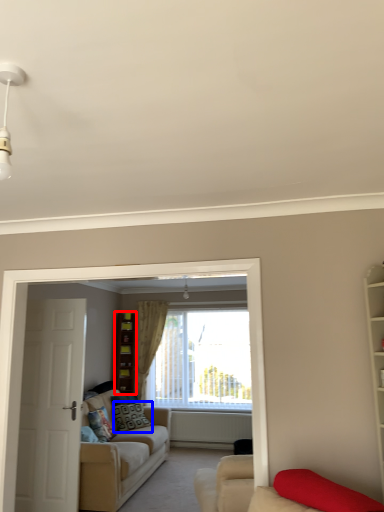
Question: Which of the following is the closest to the observer, cabinet (highlighted by a red box) or pillow (highlighted by a blue box)?

Choices:
 (A) cabinet
 (B) pillow

Answer: (B)